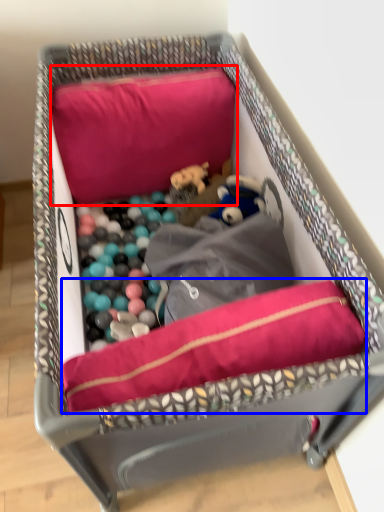
Question: Among these objects, which one is nearest to the camera, pillow (highlighted by a red box) or dog bed (highlighted by a blue box)?

Choices:
 (A) pillow
 (B) dog bed

Answer: (B)